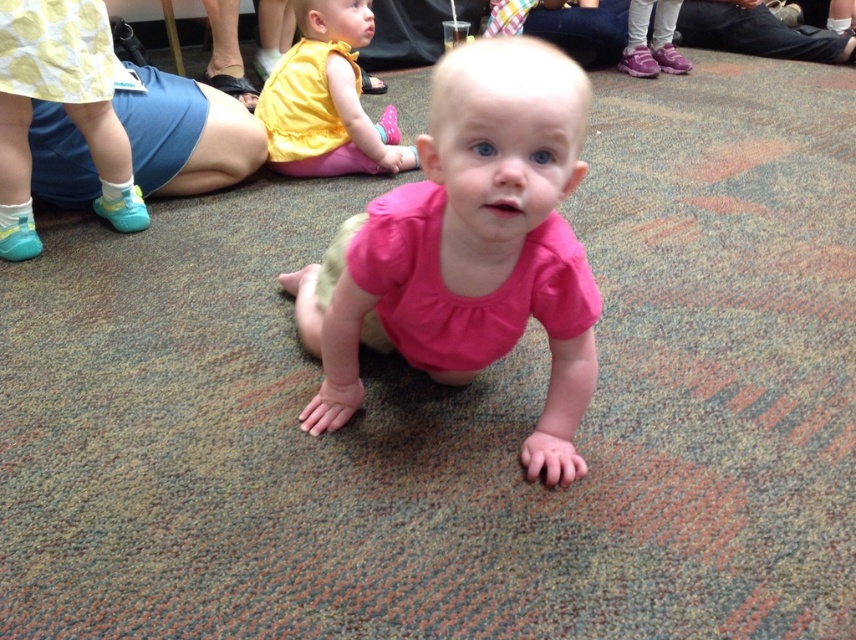
Consider the image. You are a photographer trying to capture a candid shot of the pink fabric toddler at center and the yellow matte dress at upper center. Since you want both subjects in focus, which one should you adjust your camera focus to prioritize? Please explain your reasoning based on their positions in the scene.

You should prioritize focusing on the pink fabric toddler at center because it is closer to the viewer than the yellow matte dress at upper center. In photography, objects closer to the camera are more in focus when using a shallow depth of field, so adjusting focus to the closer subject ensures both are sharp.

You are a photographer at the event and need to capture a photo that includes both the pink fabric toddler at center and the yellow matte dress at upper center. Given their sizes, which object should you focus on to ensure both are clearly visible in the frame?

The pink fabric toddler at center is larger in size than the yellow matte dress at upper center, so focusing on the pink fabric toddler at center would allow both objects to be clearly visible in the frame since it occupies more space and can serve as the focal point while the smaller yellow matte dress at upper center remains in view.

You are a photographer trying to capture a candid shot of the baby crawling on the carpet. You notice the pink fabric toddler at center and the yellow matte dress at upper center in your viewfinder. Which object should you move closer to in order to get a better angle of the baby?

To get a better angle of the baby crawling on the carpet, you should move closer to the yellow matte dress at upper center since the pink fabric toddler at center is to the right of it, potentially blocking the view if you stay near the toddler.